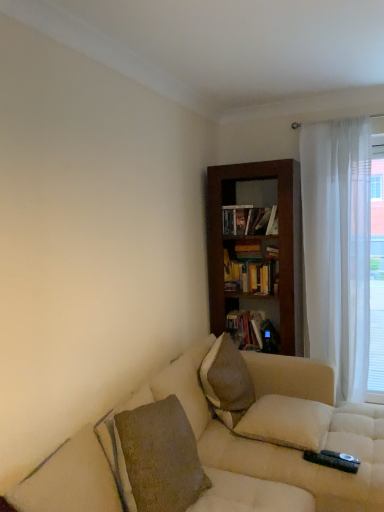
Question: Is dark wood bookcase at center thinner than white soft pillow at lower right, which is the 1th pillow in bottom-to-top order?

Choices:
 (A) no
 (B) yes

Answer: (B)

Question: Does dark wood bookcase at center come in front of white soft pillow at lower right, which ranks as the 2th pillow in top-to-bottom order?

Choices:
 (A) yes
 (B) no

Answer: (B)

Question: Does dark wood bookcase at center have a larger size compared to white soft pillow at lower right, which is the 1th pillow in bottom-to-top order?

Choices:
 (A) yes
 (B) no

Answer: (A)

Question: Does dark wood bookcase at center have a lesser height compared to white soft pillow at lower right, which is the 1th pillow in bottom-to-top order?

Choices:
 (A) yes
 (B) no

Answer: (B)

Question: Is dark wood bookcase at center looking in the opposite direction of white soft pillow at lower right, which ranks as the 2th pillow in top-to-bottom order?

Choices:
 (A) no
 (B) yes

Answer: (A)

Question: Considering the positions of dark wood bookcase at center and brown textured pillow at center, placed as the 2th pillow when sorted from bottom to top, in the image, is dark wood bookcase at center taller or shorter than brown textured pillow at center, placed as the 2th pillow when sorted from bottom to top,?

Choices:
 (A) tall
 (B) short

Answer: (A)

Question: Is dark wood bookcase at center in front of or behind brown textured pillow at center, positioned as the 1th pillow in top-to-bottom order, in the image?

Choices:
 (A) behind
 (B) front

Answer: (A)

Question: From the image's perspective, relative to brown textured pillow at center, placed as the 2th pillow when sorted from bottom to top, is dark wood bookcase at center above or below?

Choices:
 (A) below
 (B) above

Answer: (B)

Question: Is dark wood bookcase at center wider or thinner than brown textured pillow at center, placed as the 2th pillow when sorted from bottom to top?

Choices:
 (A) wide
 (B) thin

Answer: (A)

Question: Considering the positions of white soft pillow at lower right, which ranks as the 2th pillow in top-to-bottom order, and white sheer curtain at right in the image, is white soft pillow at lower right, which ranks as the 2th pillow in top-to-bottom order, taller or shorter than white sheer curtain at right?

Choices:
 (A) tall
 (B) short

Answer: (B)

Question: In terms of size, does white soft pillow at lower right, which ranks as the 2th pillow in top-to-bottom order, appear bigger or smaller than white sheer curtain at right?

Choices:
 (A) big
 (B) small

Answer: (B)

Question: Relative to white sheer curtain at right, is white soft pillow at lower right, which ranks as the 2th pillow in top-to-bottom order, in front or behind?

Choices:
 (A) front
 (B) behind

Answer: (A)

Question: Is point (266, 395) positioned closer to the camera than point (332, 193)?

Choices:
 (A) closer
 (B) farther

Answer: (A)

Question: Is white sheer curtain at right spatially inside hardcover book at upper center, which appears as the 3th book when ordered from the bottom, or outside of it?

Choices:
 (A) outside
 (B) inside

Answer: (A)

Question: Looking at the image, does white sheer curtain at right seem bigger or smaller compared to hardcover book at upper center, which is the first book in top-to-bottom order?

Choices:
 (A) big
 (B) small

Answer: (A)